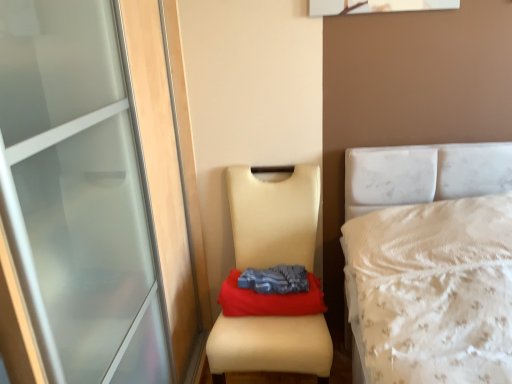
Question: From a real-world perspective, is beige leather chair at center below blue fabric at center?

Choices:
 (A) yes
 (B) no

Answer: (A)

Question: Considering the relative sizes of beige leather chair at center and blue fabric at center in the image provided, is beige leather chair at center thinner than blue fabric at center?

Choices:
 (A) yes
 (B) no

Answer: (B)

Question: Can you confirm if beige leather chair at center is positioned to the left of blue fabric at center?

Choices:
 (A) yes
 (B) no

Answer: (B)

Question: Is beige leather chair at center wider than blue fabric at center?

Choices:
 (A) no
 (B) yes

Answer: (B)

Question: From the image's perspective, is beige leather chair at center on blue fabric at center?

Choices:
 (A) yes
 (B) no

Answer: (B)

Question: From a real-world perspective, is blue fabric at center above or below blue fabric at center?

Choices:
 (A) below
 (B) above

Answer: (A)

Question: In terms of size, does blue fabric at center appear bigger or smaller than blue fabric at center?

Choices:
 (A) big
 (B) small

Answer: (A)

Question: Is blue fabric at center inside or outside of blue fabric at center?

Choices:
 (A) inside
 (B) outside

Answer: (B)

Question: Considering the positions of blue fabric at center and blue fabric at center in the image, is blue fabric at center wider or thinner than blue fabric at center?

Choices:
 (A) wide
 (B) thin

Answer: (A)

Question: In the image, is blue fabric at center positioned in front of or behind beige leather chair at center?

Choices:
 (A) behind
 (B) front

Answer: (A)

Question: Looking at their shapes, would you say blue fabric at center is wider or thinner than beige leather chair at center?

Choices:
 (A) wide
 (B) thin

Answer: (B)

Question: From their relative heights in the image, would you say blue fabric at center is taller or shorter than beige leather chair at center?

Choices:
 (A) short
 (B) tall

Answer: (A)

Question: Based on their sizes in the image, would you say blue fabric at center is bigger or smaller than beige leather chair at center?

Choices:
 (A) small
 (B) big

Answer: (A)

Question: Does point (217, 327) appear closer or farther from the camera than point (245, 289)?

Choices:
 (A) closer
 (B) farther

Answer: (A)

Question: Based on their sizes in the image, would you say beige leather chair at center is bigger or smaller than blue fabric at center?

Choices:
 (A) big
 (B) small

Answer: (A)